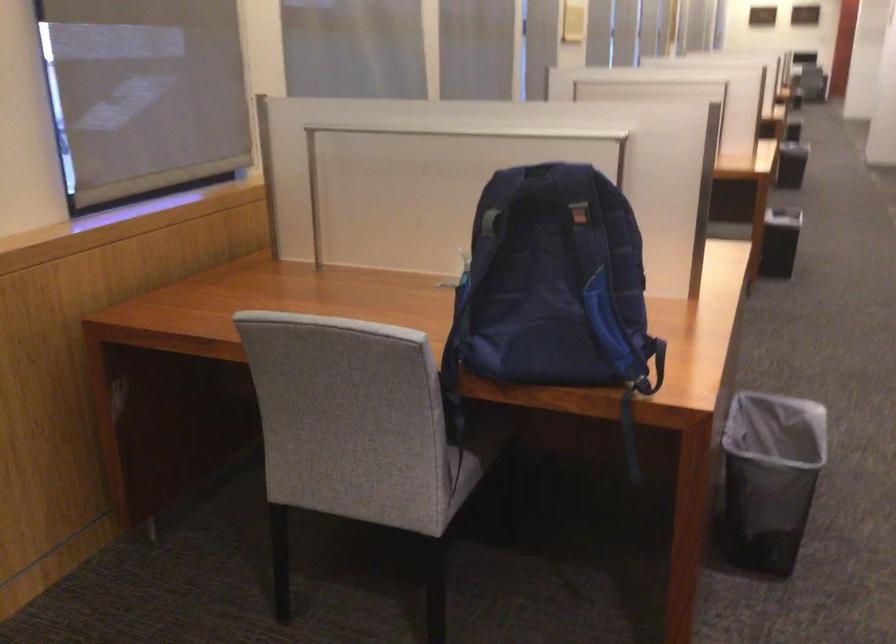
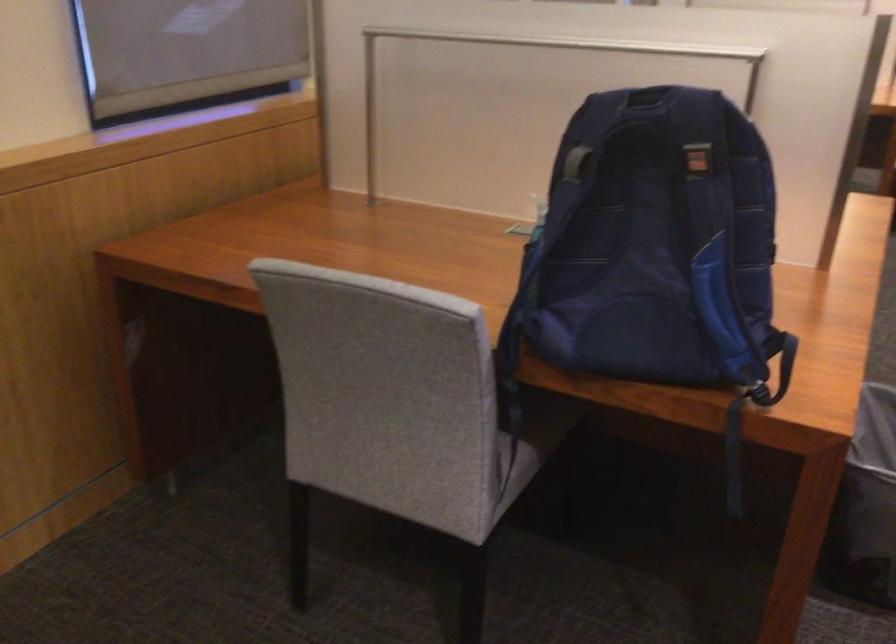
Question: The images are taken continuously from a first-person perspective. In which direction are you moving?

Choices:
 (A) Left
 (B) Right
 (C) Forward
 (D) Backward

Answer: (C)